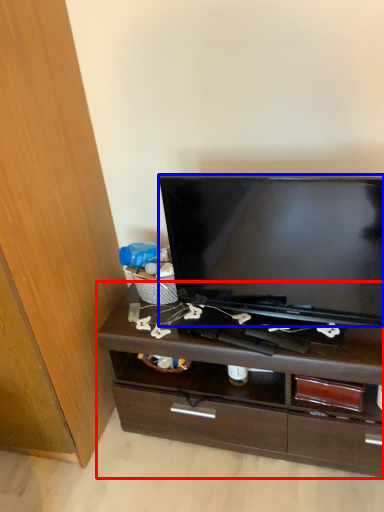
Question: Which object appears farthest to the camera in this image, chest of drawers (highlighted by a red box) or television (highlighted by a blue box)?

Choices:
 (A) chest of drawers
 (B) television

Answer: (A)